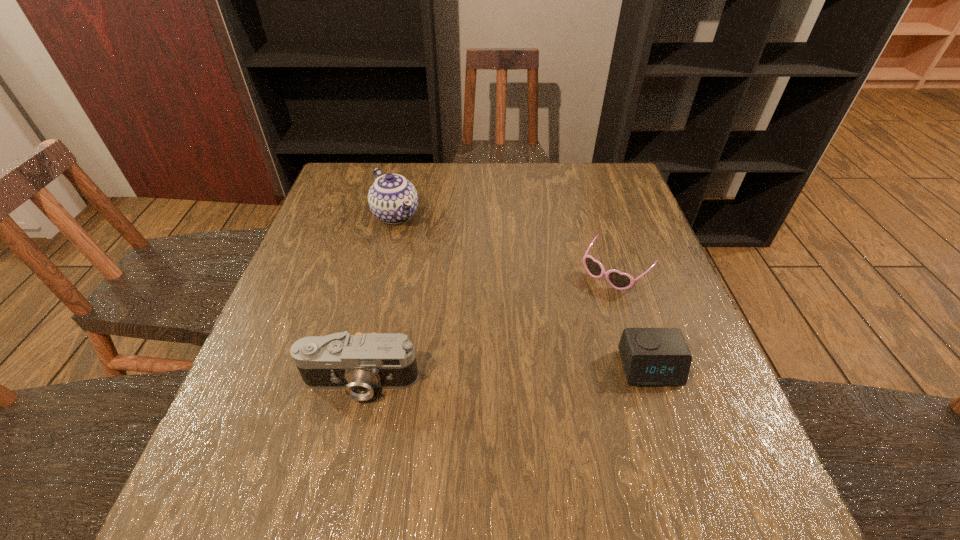
The image size is (960, 540). I want to click on free space on the desktop that is between the camera and the third tallest object and is positioned on the front-facing side of the sunglasses, so click(520, 374).

Find the location of a particular element. free space on the desktop that is between the camera and the alarm clock and is positioned at the spout of the tallest object is located at coordinates (538, 373).